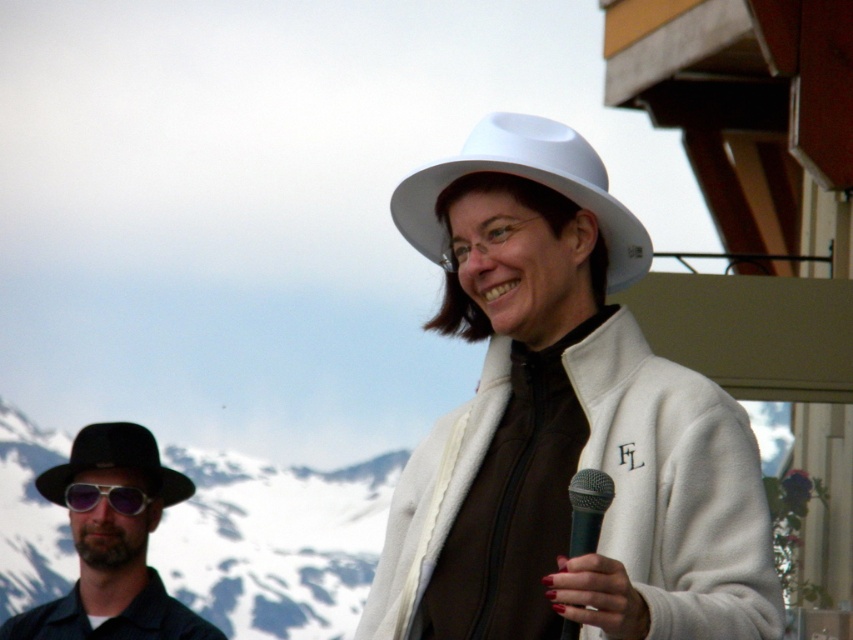
Who is more forward, [437,164] or [73,492]?

Positioned in front is point [437,164].

Does white matte fedora at center have a larger size compared to purple reflective goggles at left?

Correct, white matte fedora at center is larger in size than purple reflective goggles at left.

Is point (640, 269) less distant than point (140, 512)?

Yes, point (640, 269) is in front of point (140, 512).

Locate an element on the screen. white matte fedora at center is located at coordinates (x=529, y=179).

Is white matte fedora at center bigger than black felt fedora at left?

No, white matte fedora at center is not bigger than black felt fedora at left.

Is white matte fedora at center taller than black felt fedora at left?

Yes.

Where is `white matte fedora at center`? white matte fedora at center is located at coordinates (529, 179).

Where is `white matte hat at center`? white matte hat at center is located at coordinates (563, 424).

Is white matte hat at center wider than snowy mountain at left?

No, white matte hat at center is not wider than snowy mountain at left.

Who is more distant from viewer, (558, 346) or (56, 524)?

The point (56, 524) is behind.

Locate an element on the screen. The height and width of the screenshot is (640, 853). white matte hat at center is located at coordinates (563, 424).